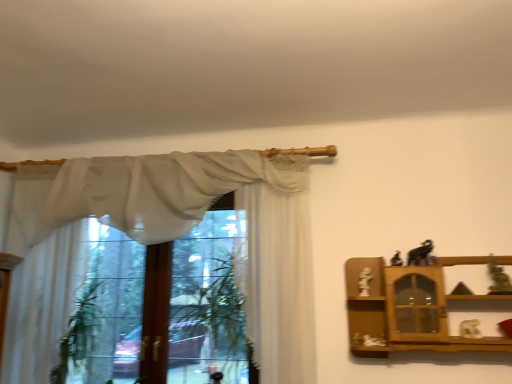
Question: Considering the positions of white sheer curtain at left, which ranks as the first curtain in left-to-right order, and matte black elephant at upper right, which is the 2th toy in left-to-right order, in the image, is white sheer curtain at left, which ranks as the first curtain in left-to-right order, taller or shorter than matte black elephant at upper right, which is the 2th toy in left-to-right order,?

Choices:
 (A) tall
 (B) short

Answer: (A)

Question: From the image's perspective, is white sheer curtain at left, acting as the third curtain starting from the right, positioned above or below matte black elephant at upper right, which is the 2th toy in left-to-right order?

Choices:
 (A) below
 (B) above

Answer: (A)

Question: Which object is positioned closest to the white matte statue at right, the fifth toy in the right-to-left sequence?

Choices:
 (A) matte gray statue at right, the 1th toy when ordered from right to left
 (B) green leafy plant at center
 (C) white sheer curtain at left, which ranks as the first curtain in left-to-right order
 (D) sheer white curtain at upper left, which is the second curtain from right to left
 (E) matte black elephant at upper right, positioned as the 3th toy in left-to-right order

Answer: (E)

Question: Which of these objects is positioned closest to the white sheer curtain at center, placed as the third curtain when sorted from left to right?

Choices:
 (A) white sheer curtain at left, acting as the third curtain starting from the right
 (B) matte black elephant at upper right, arranged as the 3th toy when viewed from the right
 (C) matte black elephant at upper right, which is the 2th toy in left-to-right order
 (D) green leafy plant at center
 (E) wooden cabinet at right

Answer: (E)